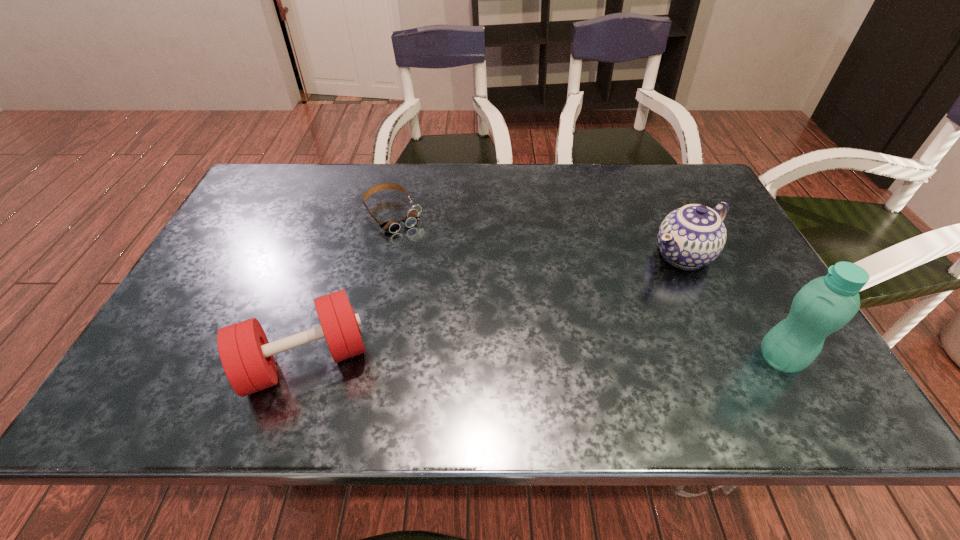
Locate an element on the screen. free space at the left edge is located at coordinates click(229, 292).

The width and height of the screenshot is (960, 540). I want to click on vacant space at the right edge, so click(724, 325).

Identify the location of vacant point at the near right corner. (753, 372).

At what (x,y) coordinates should I click in order to perform the action: click on vacant region between the bottle and the chinaware. Please return your answer as a coordinate pair (x, y). The width and height of the screenshot is (960, 540). Looking at the image, I should click on (732, 307).

In order to click on free spot between the chinaware and the tallest object in this screenshot , I will do `click(732, 307)`.

The image size is (960, 540). I want to click on empty space between the dumbbell and the shortest object, so click(349, 287).

This screenshot has width=960, height=540. In order to click on empty space between the tallest object and the goggles in this screenshot , I will do click(x=588, y=287).

What are the coordinates of `empty location between the chinaware and the bottle` in the screenshot? It's located at (732, 307).

At what (x,y) coordinates should I click in order to perform the action: click on free space between the tallest object and the goggles. Please return your answer as a coordinate pair (x, y). The width and height of the screenshot is (960, 540). Looking at the image, I should click on (588, 287).

Where is `free area in between the chinaware and the shortest object`? The image size is (960, 540). free area in between the chinaware and the shortest object is located at coordinates (539, 235).